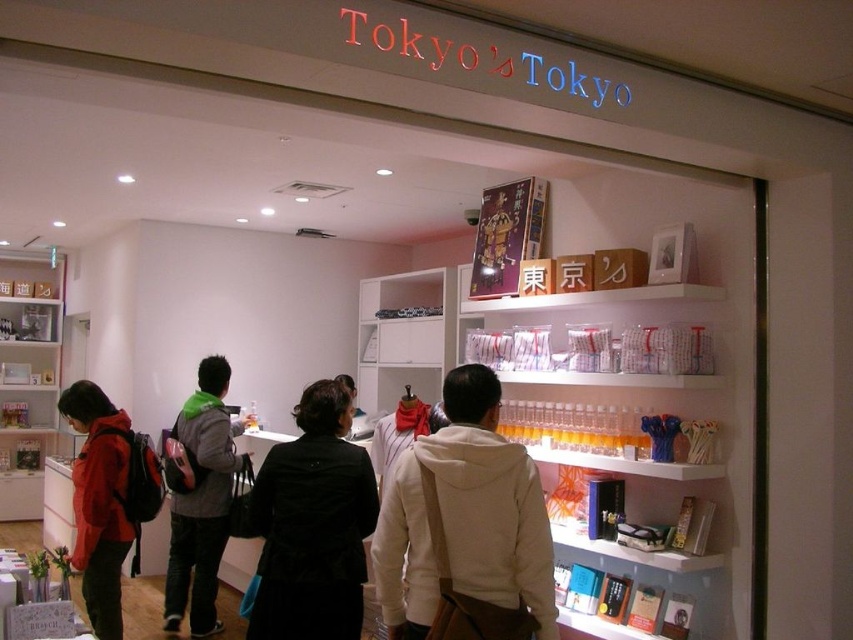
Which is more to the right, black velvet coat at center or gray backpack at center?

Positioned to the right is black velvet coat at center.

Which is behind, point (300, 605) or point (207, 451)?

The point (207, 451) is behind.

Which is behind, point (345, 394) or point (221, 404)?

Positioned behind is point (221, 404).

At what (x,y) coordinates should I click in order to perform the action: click on black velvet coat at center. Please return your answer as a coordinate pair (x, y). Looking at the image, I should click on (312, 524).

Can you confirm if white fleece jacket at center is wider than gray backpack at center?

No.

Does white fleece jacket at center appear under gray backpack at center?

Actually, white fleece jacket at center is above gray backpack at center.

This screenshot has height=640, width=853. What do you see at coordinates (465, 529) in the screenshot? I see `white fleece jacket at center` at bounding box center [465, 529].

At what (x,y) coordinates should I click in order to perform the action: click on white fleece jacket at center. Please return your answer as a coordinate pair (x, y). Looking at the image, I should click on (465, 529).

Looking at this image, can you confirm if white fleece jacket at center is taller than black velvet coat at center?

Incorrect, white fleece jacket at center's height is not larger of black velvet coat at center's.

Based on the photo, does white fleece jacket at center have a lesser height compared to black velvet coat at center?

Indeed, white fleece jacket at center has a lesser height compared to black velvet coat at center.

This screenshot has width=853, height=640. What do you see at coordinates (465, 529) in the screenshot?
I see `white fleece jacket at center` at bounding box center [465, 529].

The width and height of the screenshot is (853, 640). Identify the location of white fleece jacket at center. (465, 529).